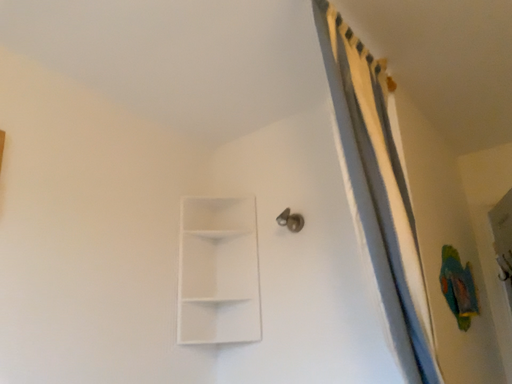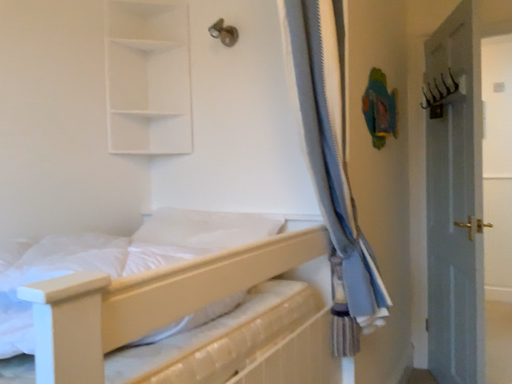
Question: How did the camera likely rotate when shooting the video?

Choices:
 (A) rotated upward
 (B) rotated downward

Answer: (B)